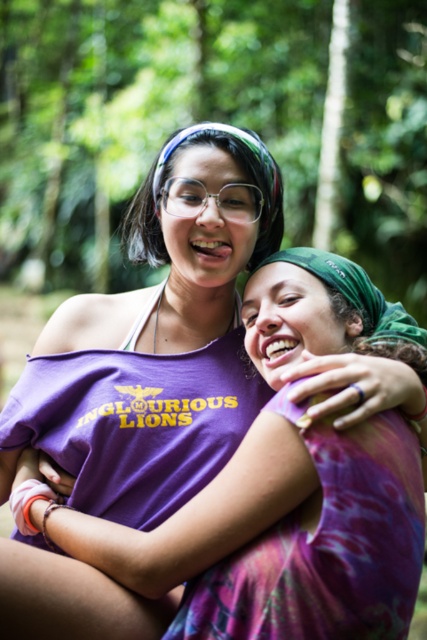
You are a photographer trying to capture a closeup of the clear plastic glasses at center in the image. However, the purple cotton shirt at center is blocking your view. Can you estimate whether the glasses are fully visible or partially hidden behind the shirt?

The purple cotton shirt at center has a greater height compared to clear plastic glasses at center. Since the shirt is taller, it might partially or fully hide the glasses depending on their vertical positions. However, since both are at the center, the glasses could be positioned lower and still visible. Without exact vertical positions, it is uncertain if they are fully visible or hidden.